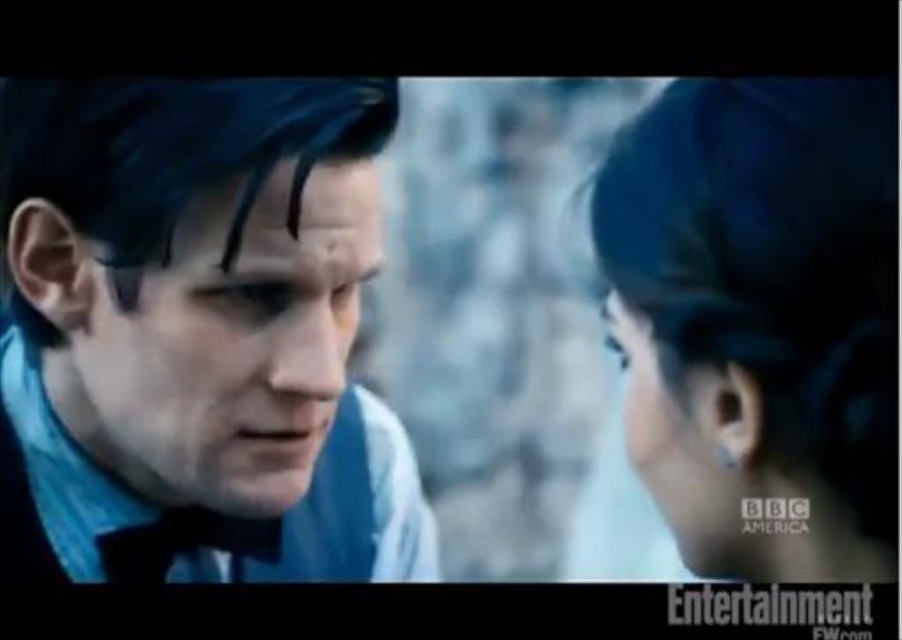
Question: Does blue velvet suit at left have a smaller size compared to blue hair at upper right?

Choices:
 (A) no
 (B) yes

Answer: (A)

Question: Which object is positioned farthest from the matte blue scarf at left?

Choices:
 (A) blue hair at upper right
 (B) blue velvet suit at left
 (C) smooth skin forehead at center
 (D) black silky eyebrow at upper center

Answer: (A)

Question: Which is nearer to the black silky eyebrow at upper center?

Choices:
 (A) matte blue scarf at left
 (B) blue hair at upper right
 (C) blue velvet suit at left
 (D) smooth skin forehead at center

Answer: (D)

Question: Does blue velvet suit at left have a larger size compared to blue hair at upper right?

Choices:
 (A) no
 (B) yes

Answer: (B)

Question: Which point is closer to the camera taking this photo?

Choices:
 (A) (212, 193)
 (B) (224, 464)

Answer: (A)

Question: Can you confirm if smooth skin forehead at center is positioned to the left of black silky eyebrow at upper center?

Choices:
 (A) yes
 (B) no

Answer: (A)